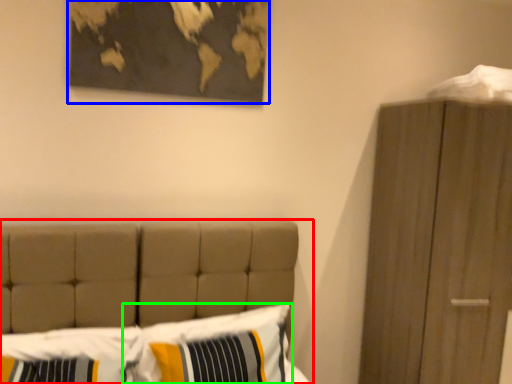
Question: Based on their relative distances, which object is nearer to bed (highlighted by a red box)? Choose from picture frame (highlighted by a blue box) and pillow (highlighted by a green box).

Choices:
 (A) picture frame
 (B) pillow

Answer: (B)